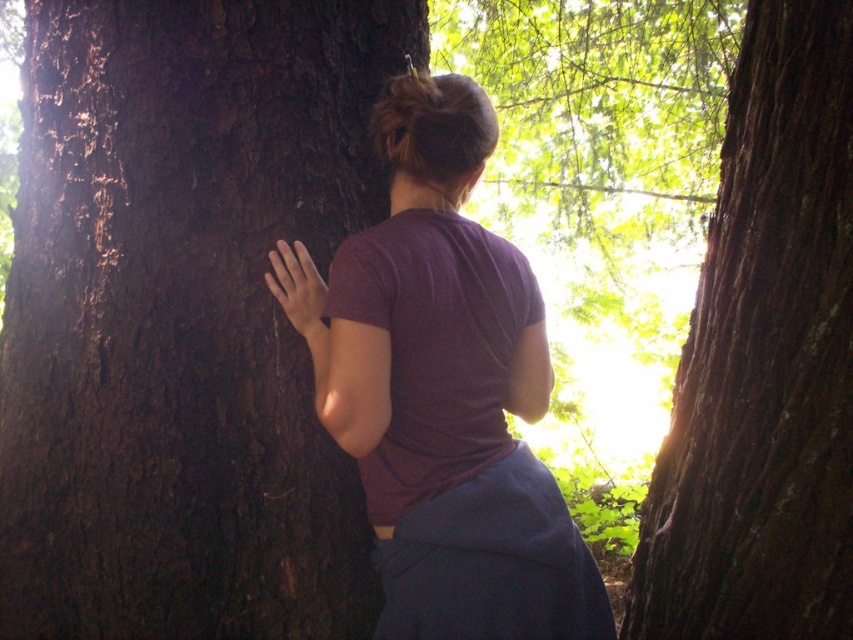
You are a hiker who wants to take a photo of the dark brown rough tree trunk at left. You are standing at point (183, 317). Which direction should you face to capture the tree trunk in your camera?

The point (183, 317) indicates the dark brown rough tree trunk at left, so you should face towards the left to capture the tree trunk in your camera.

You are a photographer trying to capture the purple matte shirt at center in your shot. However, the dark brown rough tree trunk at left is blocking your view. Can you move the tree trunk to get a clear shot of the shirt?

The purple matte shirt at center is behind the dark brown rough tree trunk at left, so you cannot move the tree trunk to get a clear shot of the shirt. You might need to reposition yourself or the person to ensure the shirt is visible without obstruction.